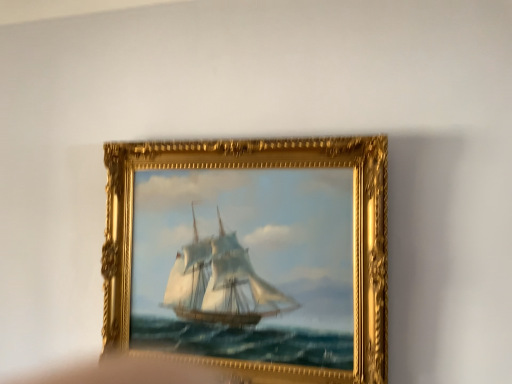
At what (x,y) coordinates should I click in order to perform the action: click on gold ornate frame at center. Please return your answer as a coordinate pair (x, y). Looking at the image, I should click on (250, 256).

This screenshot has width=512, height=384. What do you see at coordinates (250, 256) in the screenshot? I see `gold ornate frame at center` at bounding box center [250, 256].

Locate an element on the screen. gold ornate frame at center is located at coordinates (250, 256).